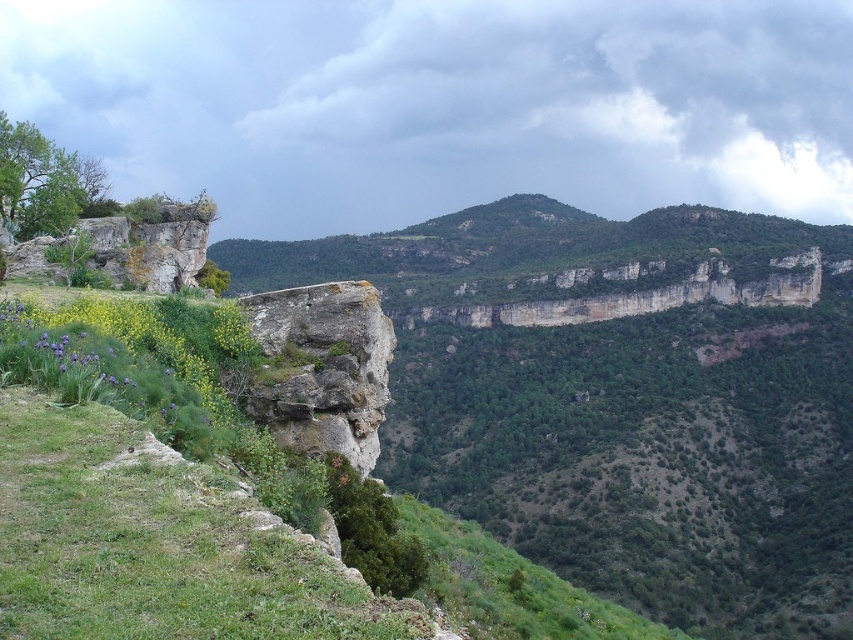
You are standing at the base of the cliff in the image. There is a point marked at coordinates point (97, 406). Can you reach this point by walking straight ahead without needing to climb or descend steeply?

The point (97, 406) is 29.78 meters away from the viewer. Since it is at a distance but the terrain between you and the point isn not specified as steep or requiring climbing, it is possible to walk straight ahead to reach it.